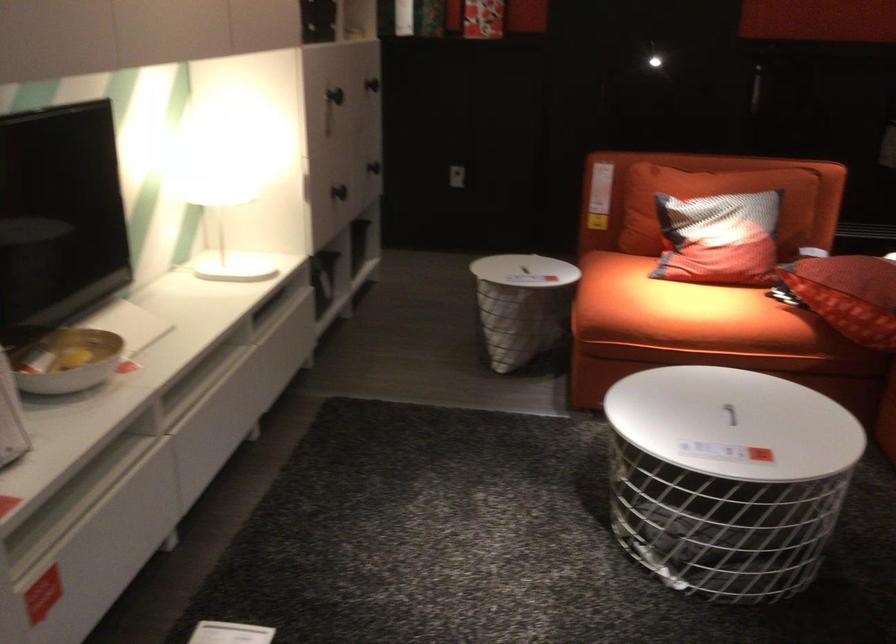
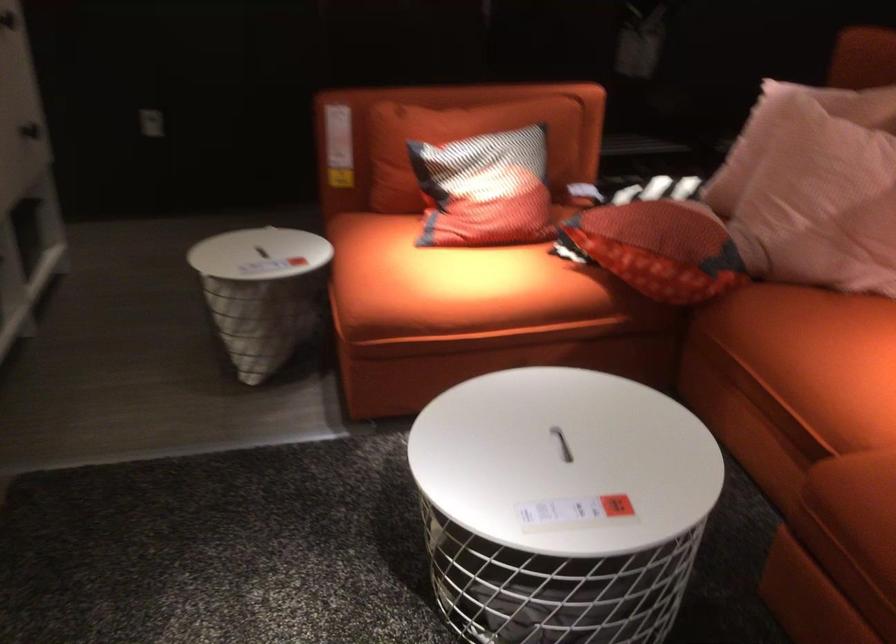
In the second image, find the point that corresponds to point (733, 427) in the first image.

(562, 444)